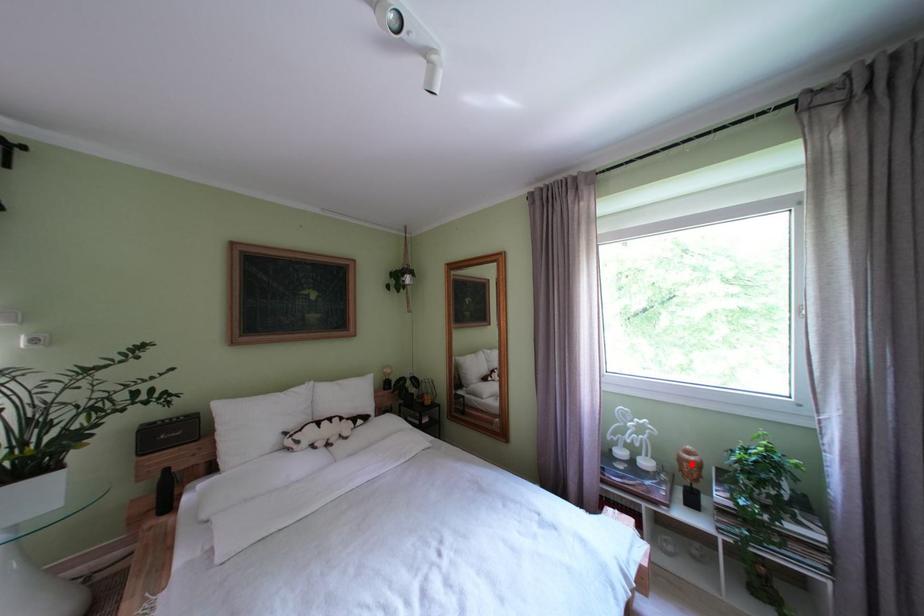
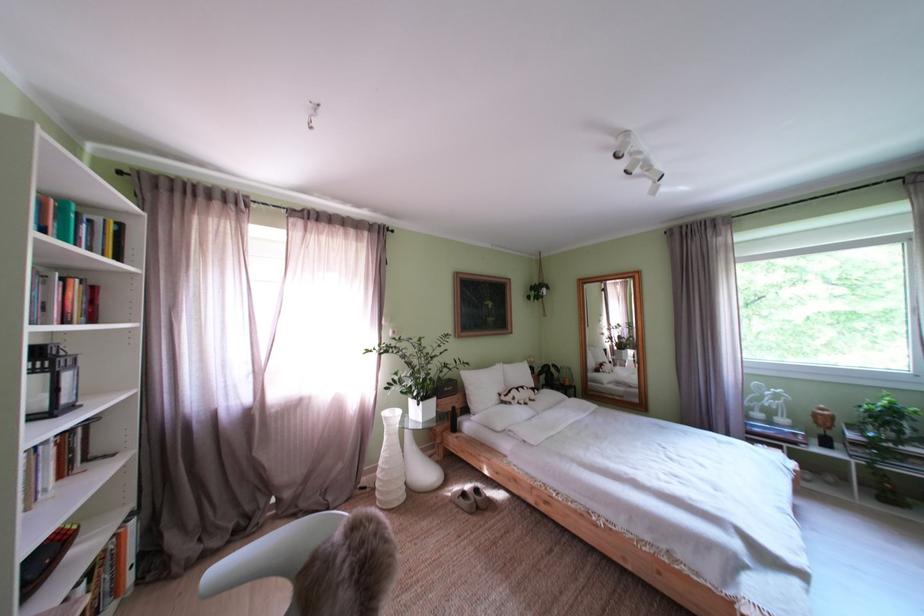
Question: I am providing you with two images of the same scene from different viewpoints. Given a red point in image1, look at the same physical point in image2. Is it:

Choices:
 (A) Closer to the viewpoint
 (B) Farther from the viewpoint

Answer: (A)